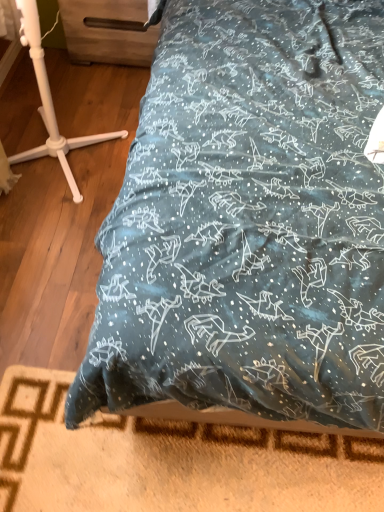
Find the location of `vacant space in wooden bed frame at lower center (from a real-world perspective)`. vacant space in wooden bed frame at lower center (from a real-world perspective) is located at coordinates (184, 466).